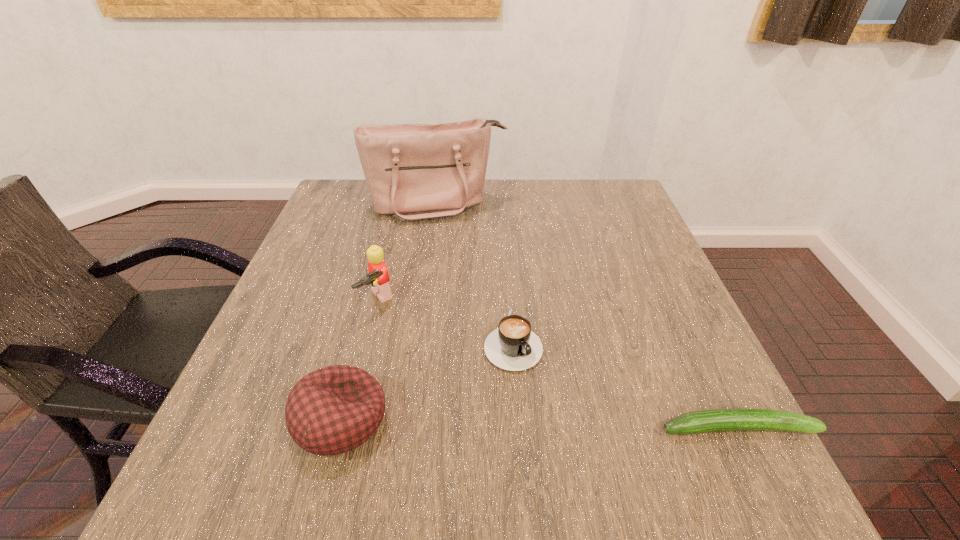
This screenshot has width=960, height=540. In order to click on blank space located 0.290m on the front pocket of the tallest object in this screenshot , I will do `click(467, 297)`.

Where is `vacant space located 0.250m on the front pocket of the tallest object`? The image size is (960, 540). vacant space located 0.250m on the front pocket of the tallest object is located at coordinates (464, 285).

The image size is (960, 540). I want to click on vacant position located on the front pocket of the tallest object, so click(x=452, y=240).

Image resolution: width=960 pixels, height=540 pixels. I want to click on vacant space located in front of the fourth shortest object with the accessory visible, so click(426, 367).

At what (x,y) coordinates should I click in order to perform the action: click on blank space located in front of the fourth shortest object with the accessory visible. Please return your answer as a coordinate pair (x, y). Looking at the image, I should click on (442, 384).

Find the location of a particular element. The width and height of the screenshot is (960, 540). free space located 0.090m in front of the fourth shortest object with the accessory visible is located at coordinates (405, 341).

At what (x,y) coordinates should I click in order to perform the action: click on object located in the far edge section of the desktop. Please return your answer as a coordinate pair (x, y). This screenshot has width=960, height=540. Looking at the image, I should click on (414, 172).

Where is `beanbag that is at the near edge`? beanbag that is at the near edge is located at coordinates (335, 409).

Where is `zucchini that is at the near edge`? The height and width of the screenshot is (540, 960). zucchini that is at the near edge is located at coordinates (703, 421).

Image resolution: width=960 pixels, height=540 pixels. I want to click on beanbag located at the left edge, so click(x=335, y=409).